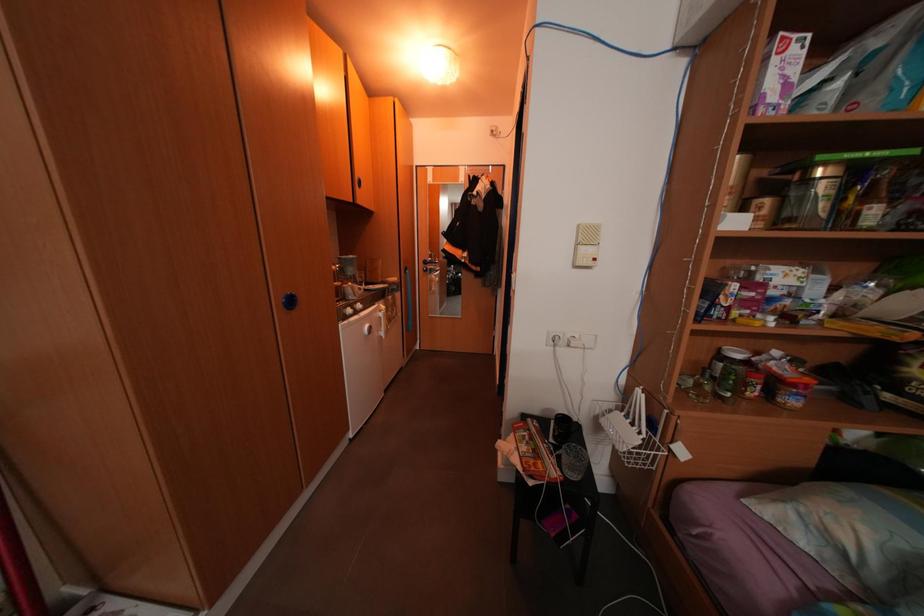
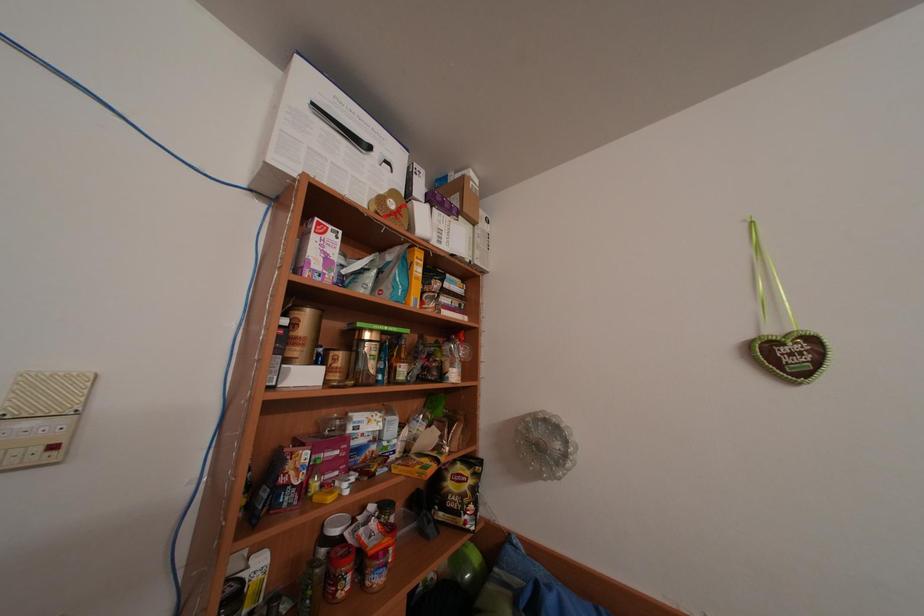
From the picture: Based on the continuous images, in which direction is the camera rotating?

The rotation direction of the camera is right-up.